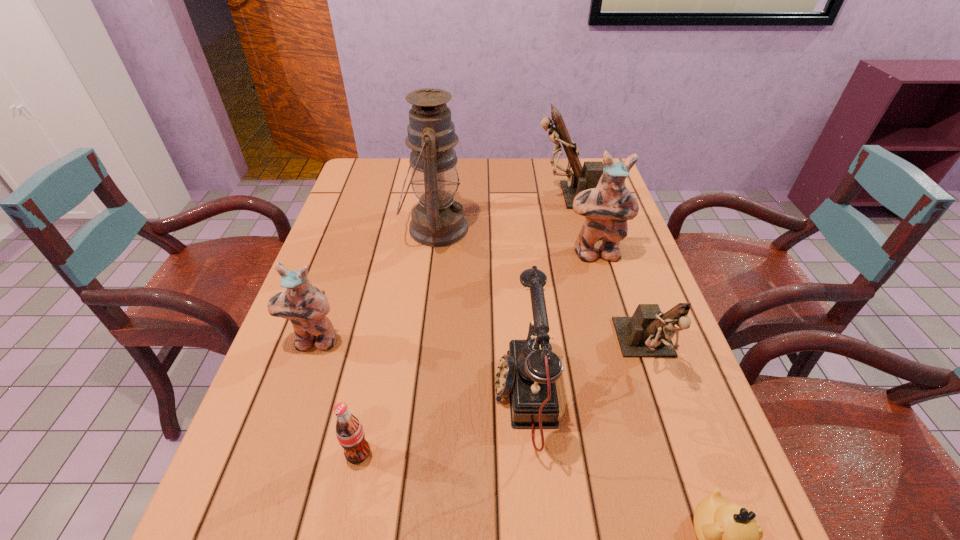
In order to click on free space between the telephone and the bigger pink figurine in this screenshot , I will do `click(560, 325)`.

Where is `unoccupied area between the leftmost figurine and the oil lamp`? unoccupied area between the leftmost figurine and the oil lamp is located at coordinates (374, 285).

Image resolution: width=960 pixels, height=540 pixels. In order to click on free space between the leftmost figurine and the black telephone in this screenshot , I will do pos(420,369).

The image size is (960, 540). I want to click on empty space that is in between the farthest figurine and the smaller brown figurine, so click(610, 273).

Where is `free space between the nearer pink figurine and the soda`? The image size is (960, 540). free space between the nearer pink figurine and the soda is located at coordinates (336, 397).

Find the location of `vacant space that's between the smaller pink figurine and the telephone`. vacant space that's between the smaller pink figurine and the telephone is located at coordinates (420, 369).

Locate an element on the screen. The height and width of the screenshot is (540, 960). empty location between the farther brown figurine and the tallest object is located at coordinates (504, 212).

Where is `object that is the third nearest to the black telephone`? The image size is (960, 540). object that is the third nearest to the black telephone is located at coordinates (349, 431).

Select which object is the second closest to the tallest object. Please provide its 2D coordinates. Your answer should be formatted as a tuple, i.e. [(x, y)], where the tuple contains the x and y coordinates of a point satisfying the conditions above.

[(606, 208)]

Choose which figurine is the second nearest neighbor to the second farthest figurine. Please provide its 2D coordinates. Your answer should be formatted as a tuple, i.e. [(x, y)], where the tuple contains the x and y coordinates of a point satisfying the conditions above.

[(648, 333)]